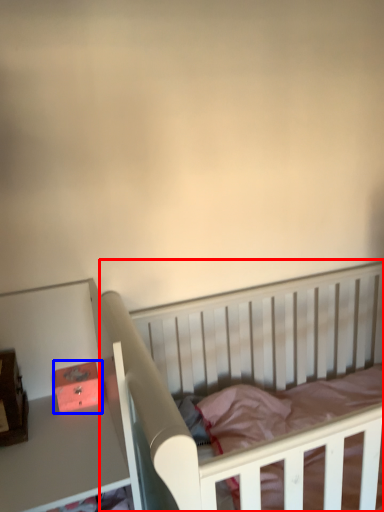
Question: Which of the following is the closest to the observer, infant bed (highlighted by a red box) or box (highlighted by a blue box)?

Choices:
 (A) infant bed
 (B) box

Answer: (A)